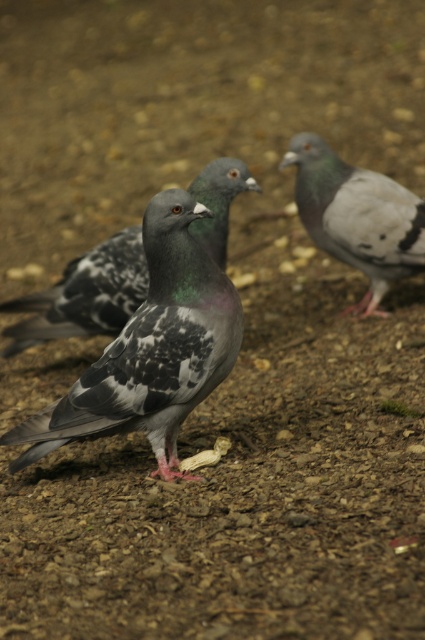
Is speckled feathered pigeon at center positioned at the back of gray matte pigeon at right?

That is False.

Looking at this image, is speckled feathered pigeon at center positioned in front of gray matte pigeon at right?

Yes.

Who is more distant from viewer, (159, 202) or (354, 248)?

Point (354, 248)

Identify the location of speckled feathered pigeon at center. This screenshot has height=640, width=425. (152, 349).

Does gray matte pigeon at right have a larger size compared to speckled feather pigeon at center?

Yes.

Which is behind, point (317, 244) or point (93, 333)?

The point (317, 244) is behind.

Between point (394, 230) and point (53, 333), which one is positioned in front?

Point (53, 333) is more forward.

Locate an element on the screen. Image resolution: width=425 pixels, height=640 pixels. gray matte pigeon at right is located at coordinates (357, 216).

Can you confirm if speckled feathered pigeon at center is smaller than speckled feather pigeon at center?

Actually, speckled feathered pigeon at center might be larger than speckled feather pigeon at center.

Who is positioned more to the right, speckled feathered pigeon at center or speckled feather pigeon at center?

speckled feathered pigeon at center

Between point (129, 330) and point (108, 330), which one is positioned in front?

Positioned in front is point (129, 330).

You are a GUI agent. You are given a task and a screenshot of the screen. Output one action in this format:
    pyautogui.click(x=<x>, y=<y>)
    Task: Click on the speckled feathered pigeon at center
    The width and height of the screenshot is (425, 640).
    Given the screenshot: What is the action you would take?
    pyautogui.click(x=152, y=349)